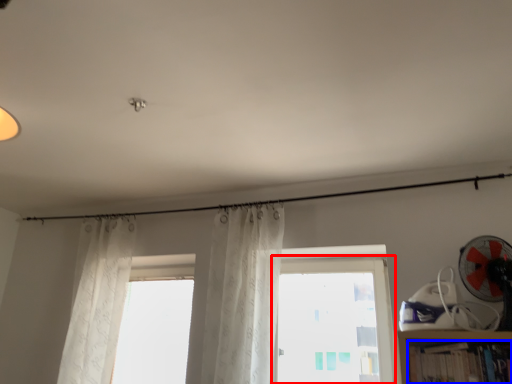
Question: Which of the following is the closest to the observer, window (highlighted by a red box) or book (highlighted by a blue box)?

Choices:
 (A) window
 (B) book

Answer: (B)